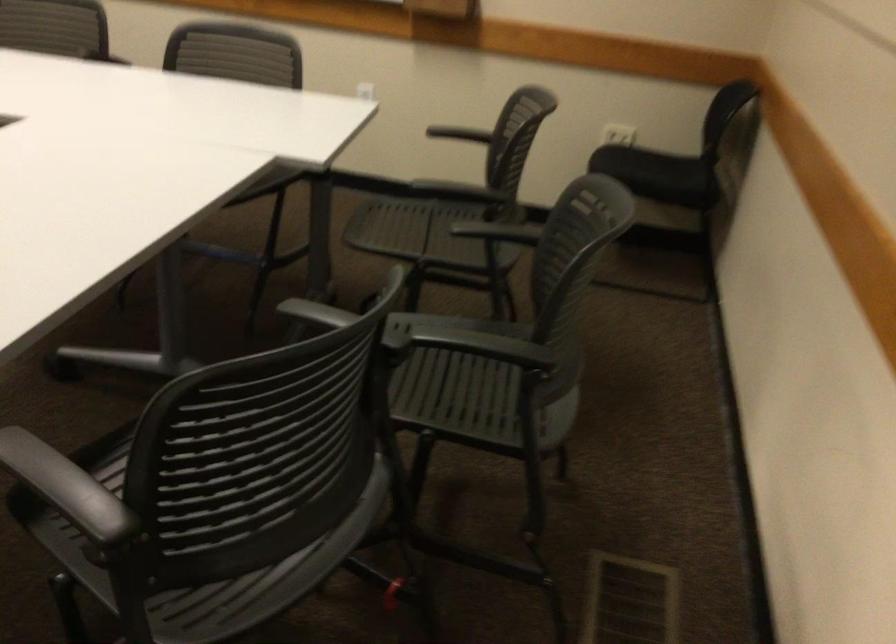
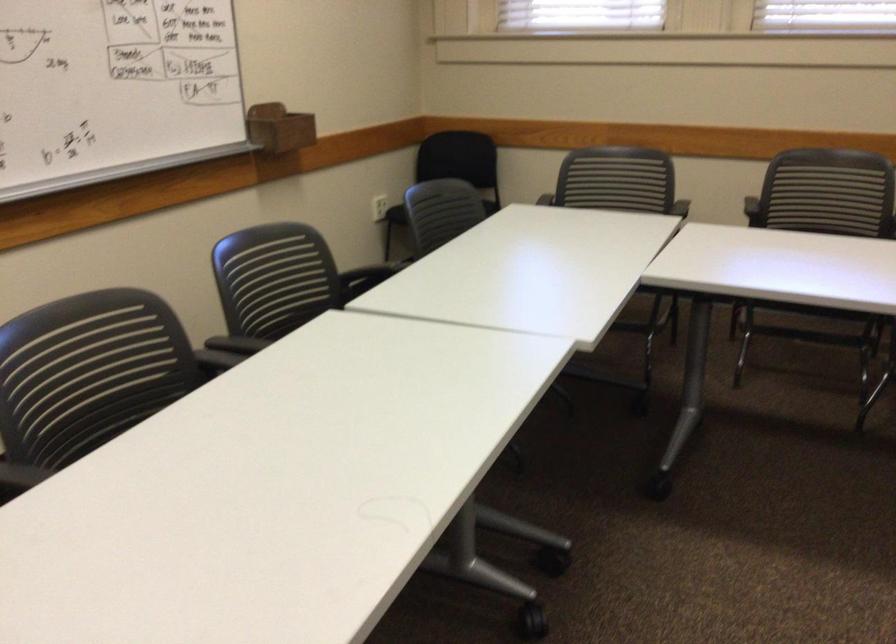
Question: I am providing you with two images of the same scene from different viewpoints. Please identify which objects are invisible in image2.

Choices:
 (A) chair sitting surface
 (B) black chair armrest
 (C) wooden marker holder
 (D) recessed silver handle

Answer: (B)